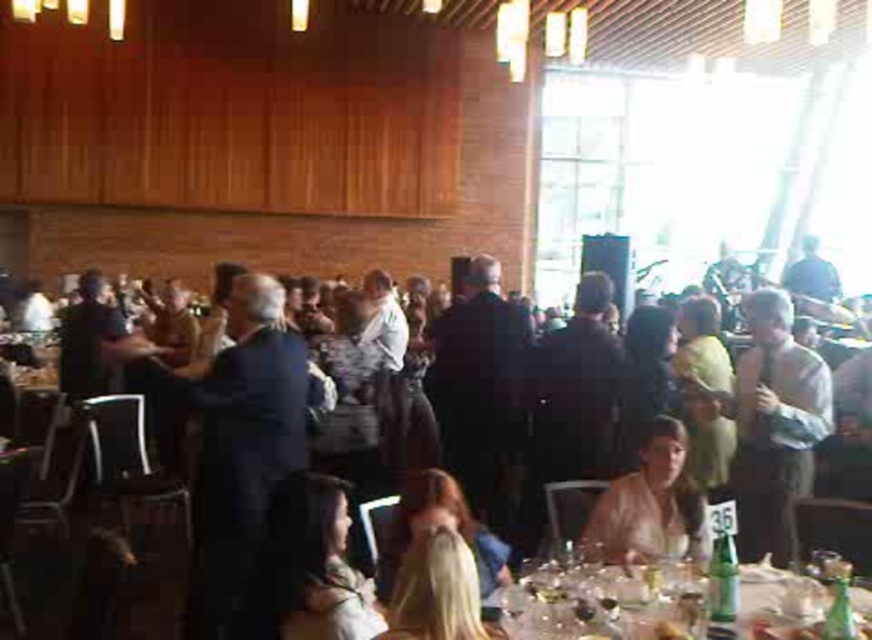
You are a guest at the event and notice the translucent glassware at lower right and the dark brown hair at lower center. Which object is bigger in size?

The translucent glassware at lower right is larger in size compared to the dark brown hair at lower center.